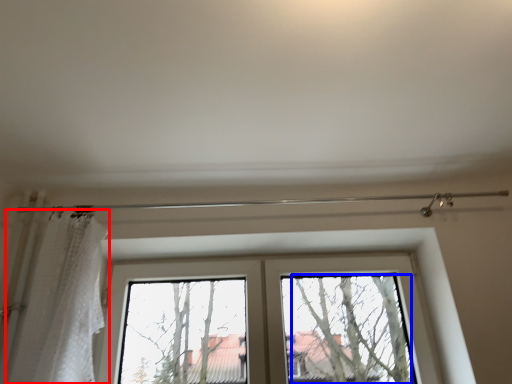
Question: Which point is closer to the camera, shower curtain (highlighted by a red box) or tree (highlighted by a blue box)?

Choices:
 (A) shower curtain
 (B) tree

Answer: (A)